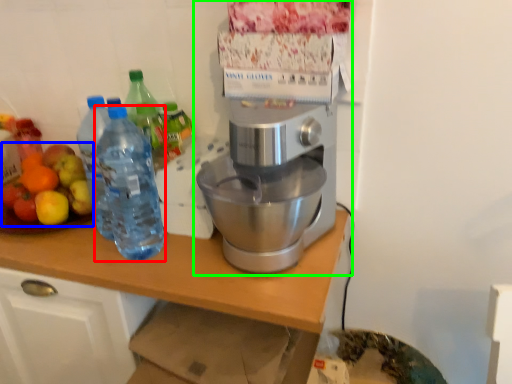
Question: Which is farther away from bottle (highlighted by a red box)? fruit salad (highlighted by a blue box) or coffee maker (highlighted by a green box)?

Choices:
 (A) fruit salad
 (B) coffee maker

Answer: (B)